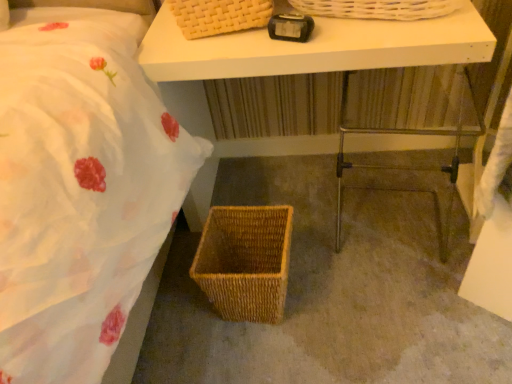
The width and height of the screenshot is (512, 384). In order to click on vacant region to the right of black plastic alarm clock at upper center in this screenshot , I will do `click(350, 31)`.